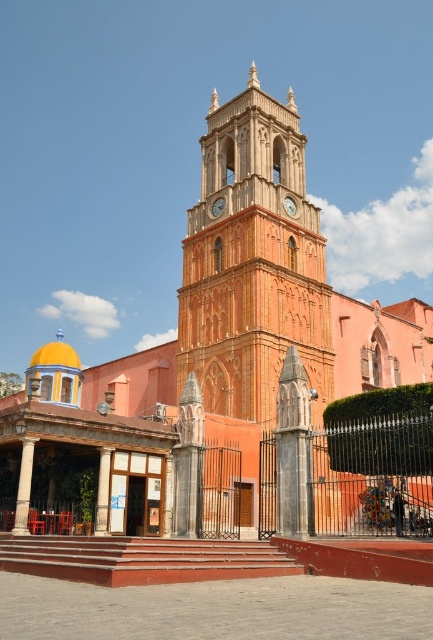
Question: Is metallic gold clock at center above metallic clock at center?

Choices:
 (A) no
 (B) yes

Answer: (B)

Question: Among these objects, which one is farthest from the camera?

Choices:
 (A) metallic gold clock at center
 (B) terracotta brick tower at center
 (C) metallic clock at center

Answer: (C)

Question: Which object is positioned closest to the terracotta brick tower at center?

Choices:
 (A) metallic gold clock at center
 (B) metallic clock at center

Answer: (A)

Question: Does metallic gold clock at center appear under metallic clock at center?

Choices:
 (A) no
 (B) yes

Answer: (A)

Question: In this image, where is terracotta brick tower at center located relative to metallic clock at center?

Choices:
 (A) left
 (B) right

Answer: (B)

Question: Which of the following is the closest to the observer?

Choices:
 (A) (212, 204)
 (B) (286, 202)
 (C) (255, 70)

Answer: (B)